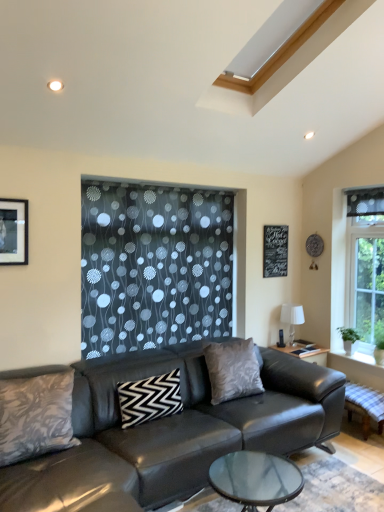
Question: Is point (87, 483) closer or farther from the camera than point (283, 304)?

Choices:
 (A) farther
 (B) closer

Answer: (B)

Question: In the image, is leather couch at center positioned in front of or behind white fabric lampshade at right?

Choices:
 (A) front
 (B) behind

Answer: (A)

Question: Estimate the real-world distances between objects in this image. Which object is farther from the white fabric lampshade at right?

Choices:
 (A) leather couch at center
 (B) black chalkboard at upper center
 (C) silky gray pillow at center, placed as the 3th pillow when sorted from left to right
 (D) matte black picture frame at upper left
 (E) white textured stone window sill at lower right

Answer: (D)

Question: Which object is the farthest from the black chalkboard at upper center?

Choices:
 (A) silky gray pillow at center, placed as the 3th pillow when sorted from left to right
 (B) matte black picture frame at upper left
 (C) white textured stone window sill at lower right
 (D) leather couch at center
 (E) white fabric lampshade at right

Answer: (B)